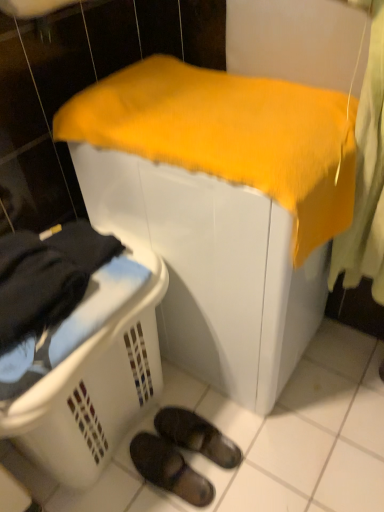
Where is `black suede slippers at lower center, which is counted as the first footwear, starting from the top`? The height and width of the screenshot is (512, 384). black suede slippers at lower center, which is counted as the first footwear, starting from the top is located at coordinates (197, 436).

What do you see at coordinates (197, 436) in the screenshot?
I see `black suede slippers at lower center, which is counted as the first footwear, starting from the top` at bounding box center [197, 436].

The width and height of the screenshot is (384, 512). Describe the element at coordinates (169, 469) in the screenshot. I see `black rubber slippers at lower center, the first footwear when ordered from bottom to top` at that location.

This screenshot has width=384, height=512. Find the location of `white plastic laundry basket at lower left`. white plastic laundry basket at lower left is located at coordinates (88, 370).

Considering the relative positions of black rubber slippers at lower center, the second footwear from the top, and white plastic laundry basket at lower left in the image provided, is black rubber slippers at lower center, the second footwear from the top, to the right of white plastic laundry basket at lower left from the viewer's perspective?

Yes.

Between point (180, 478) and point (153, 270), which one is positioned behind?

Positioned behind is point (180, 478).

How much distance is there between black rubber slippers at lower center, the second footwear from the top, and white plastic laundry basket at lower left?

black rubber slippers at lower center, the second footwear from the top, is 13.15 inches from white plastic laundry basket at lower left.

Does black rubber slippers at lower center, the second footwear from the top, contain white plastic laundry basket at lower left?

No, white plastic laundry basket at lower left is not surrounded by black rubber slippers at lower center, the second footwear from the top.

Where is `the 2nd footwear behind the yellow fabric-covered object at center, counting from the anchor's position`? The width and height of the screenshot is (384, 512). the 2nd footwear behind the yellow fabric-covered object at center, counting from the anchor's position is located at coordinates (197, 436).

Is black suede slippers at lower center, which is counted as the first footwear, starting from the top, inside the boundaries of yellow fabric-covered object at center, or outside?

black suede slippers at lower center, which is counted as the first footwear, starting from the top, is located beyond the bounds of yellow fabric-covered object at center.

Is black suede slippers at lower center, which is the second footwear from bottom to top, in front of yellow fabric-covered object at center?

No, black suede slippers at lower center, which is the second footwear from bottom to top, is behind yellow fabric-covered object at center.

From the image's perspective, which object appears higher, white plastic laundry basket at lower left or black rubber slippers at lower center, the first footwear when ordered from bottom to top?

white plastic laundry basket at lower left appears higher in the image.

Based on the photo, how many degrees apart are the facing directions of white plastic laundry basket at lower left and black rubber slippers at lower center, the second footwear from the top?

white plastic laundry basket at lower left and black rubber slippers at lower center, the second footwear from the top, are facing 174 degrees away from each other.

Is white plastic laundry basket at lower left further to camera compared to black rubber slippers at lower center, the first footwear when ordered from bottom to top?

No, white plastic laundry basket at lower left is closer to the viewer.

Is white plastic laundry basket at lower left facing towards black rubber slippers at lower center, the second footwear from the top?

No, white plastic laundry basket at lower left is not aimed at black rubber slippers at lower center, the second footwear from the top.

Considering the positions of objects black suede slippers at lower center, which is counted as the first footwear, starting from the top, and white plastic laundry basket at lower left in the image provided, who is more to the right, black suede slippers at lower center, which is counted as the first footwear, starting from the top, or white plastic laundry basket at lower left?

black suede slippers at lower center, which is counted as the first footwear, starting from the top.

In the image, is black suede slippers at lower center, which is counted as the first footwear, starting from the top, positioned in front of or behind white plastic laundry basket at lower left?

black suede slippers at lower center, which is counted as the first footwear, starting from the top, is positioned farther from the viewer than white plastic laundry basket at lower left.

Is black suede slippers at lower center, which is the second footwear from bottom to top, looking in the opposite direction of white plastic laundry basket at lower left?

black suede slippers at lower center, which is the second footwear from bottom to top, does not have its back to white plastic laundry basket at lower left.

Does white plastic laundry basket at lower left appear on the right side of yellow fabric-covered object at center?

No, white plastic laundry basket at lower left is not to the right of yellow fabric-covered object at center.

Looking at their sizes, would you say white plastic laundry basket at lower left is wider or thinner than yellow fabric-covered object at center?

In the image, white plastic laundry basket at lower left appears to be more narrow than yellow fabric-covered object at center.

Based on the photo, can you tell me how much white plastic laundry basket at lower left and yellow fabric-covered object at center differ in facing direction?

They differ by 4.74 degrees in their facing directions.

Which point is more forward, (56, 461) or (196, 446)?

The point (56, 461) is more forward.

In terms of height, does white plastic laundry basket at lower left look taller or shorter compared to black suede slippers at lower center, which is the second footwear from bottom to top?

Clearly, white plastic laundry basket at lower left is taller compared to black suede slippers at lower center, which is the second footwear from bottom to top.

Relative to black suede slippers at lower center, which is counted as the first footwear, starting from the top, is white plastic laundry basket at lower left in front or behind?

white plastic laundry basket at lower left is positioned closer to the viewer than black suede slippers at lower center, which is counted as the first footwear, starting from the top.

Is white plastic laundry basket at lower left not near black suede slippers at lower center, which is counted as the first footwear, starting from the top?

No, white plastic laundry basket at lower left is not far away from black suede slippers at lower center, which is counted as the first footwear, starting from the top.

Considering the sizes of yellow fabric-covered object at center and white plastic laundry basket at lower left in the image, is yellow fabric-covered object at center bigger or smaller than white plastic laundry basket at lower left?

Considering their sizes, yellow fabric-covered object at center takes up more space than white plastic laundry basket at lower left.

In the scene shown: From the image's perspective, is yellow fabric-covered object at center on top of white plastic laundry basket at lower left?

Indeed, from the image's perspective, yellow fabric-covered object at center is shown above white plastic laundry basket at lower left.

Between yellow fabric-covered object at center and white plastic laundry basket at lower left, which one has smaller width?

With smaller width is white plastic laundry basket at lower left.

Is yellow fabric-covered object at center positioned far away from white plastic laundry basket at lower left?

No, yellow fabric-covered object at center is not far away from white plastic laundry basket at lower left.

From a real-world perspective, which footwear is the 2nd one underneath the white plastic laundry basket at lower left? Please provide its 2D coordinates.

[(169, 469)]

Where is `furniture above the black suede slippers at lower center, which is counted as the first footwear, starting from the top (from a real-world perspective)`? furniture above the black suede slippers at lower center, which is counted as the first footwear, starting from the top (from a real-world perspective) is located at coordinates (222, 207).

Based on their spatial positions, is black rubber slippers at lower center, the second footwear from the top, or black suede slippers at lower center, which is the second footwear from bottom to top, closer to yellow fabric-covered object at center?

black suede slippers at lower center, which is the second footwear from bottom to top.

Considering their positions, is black suede slippers at lower center, which is counted as the first footwear, starting from the top, positioned further to yellow fabric-covered object at center than black rubber slippers at lower center, the first footwear when ordered from bottom to top?

Based on the image, black rubber slippers at lower center, the first footwear when ordered from bottom to top, appears to be further to yellow fabric-covered object at center.

Considering their positions, is black suede slippers at lower center, which is counted as the first footwear, starting from the top, positioned closer to white plastic laundry basket at lower left than black rubber slippers at lower center, the first footwear when ordered from bottom to top?

black rubber slippers at lower center, the first footwear when ordered from bottom to top.

From the picture: Which object lies further to the anchor point white plastic laundry basket at lower left, black rubber slippers at lower center, the first footwear when ordered from bottom to top, or black suede slippers at lower center, which is counted as the first footwear, starting from the top?

Among the two, black suede slippers at lower center, which is counted as the first footwear, starting from the top, is located further to white plastic laundry basket at lower left.

Which object lies nearer to the anchor point black rubber slippers at lower center, the first footwear when ordered from bottom to top, black suede slippers at lower center, which is counted as the first footwear, starting from the top, or white plastic laundry basket at lower left?

black suede slippers at lower center, which is counted as the first footwear, starting from the top.

Estimate the real-world distances between objects in this image. Which object is closer to yellow fabric-covered object at center, black suede slippers at lower center, which is the second footwear from bottom to top, or white plastic laundry basket at lower left?

The object closer to yellow fabric-covered object at center is white plastic laundry basket at lower left.

When comparing their distances from black suede slippers at lower center, which is counted as the first footwear, starting from the top, does white plastic laundry basket at lower left or black rubber slippers at lower center, the second footwear from the top, seem further?

white plastic laundry basket at lower left is positioned further to the anchor black suede slippers at lower center, which is counted as the first footwear, starting from the top.

From the picture: Considering their positions, is white plastic laundry basket at lower left positioned closer to black suede slippers at lower center, which is the second footwear from bottom to top, than yellow fabric-covered object at center?

white plastic laundry basket at lower left is positioned closer to the anchor black suede slippers at lower center, which is the second footwear from bottom to top.

Where is `laundry basket between yellow fabric-covered object at center and black suede slippers at lower center, which is counted as the first footwear, starting from the top, in the up-down direction`? This screenshot has height=512, width=384. laundry basket between yellow fabric-covered object at center and black suede slippers at lower center, which is counted as the first footwear, starting from the top, in the up-down direction is located at coordinates (88, 370).

Find the location of a particular element. footwear between white plastic laundry basket at lower left and black suede slippers at lower center, which is the second footwear from bottom to top, in the front-back direction is located at coordinates (169, 469).

Identify the location of laundry basket between yellow fabric-covered object at center and black rubber slippers at lower center, the first footwear when ordered from bottom to top, in the up-down direction. The image size is (384, 512). (88, 370).

At what (x,y) coordinates should I click in order to perform the action: click on footwear between yellow fabric-covered object at center and black rubber slippers at lower center, the second footwear from the top, vertically. Please return your answer as a coordinate pair (x, y). The image size is (384, 512). Looking at the image, I should click on (197, 436).